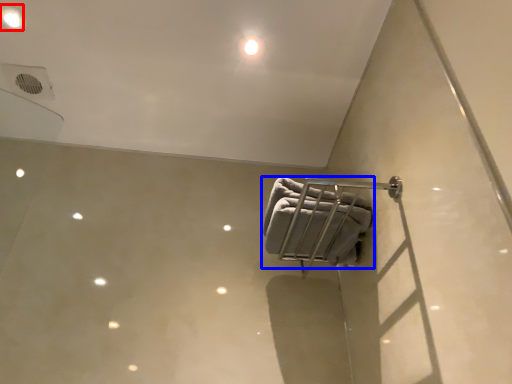
Question: Which object is further to the camera taking this photo, dot (highlighted by a red box) or towel (highlighted by a blue box)?

Choices:
 (A) dot
 (B) towel

Answer: (A)